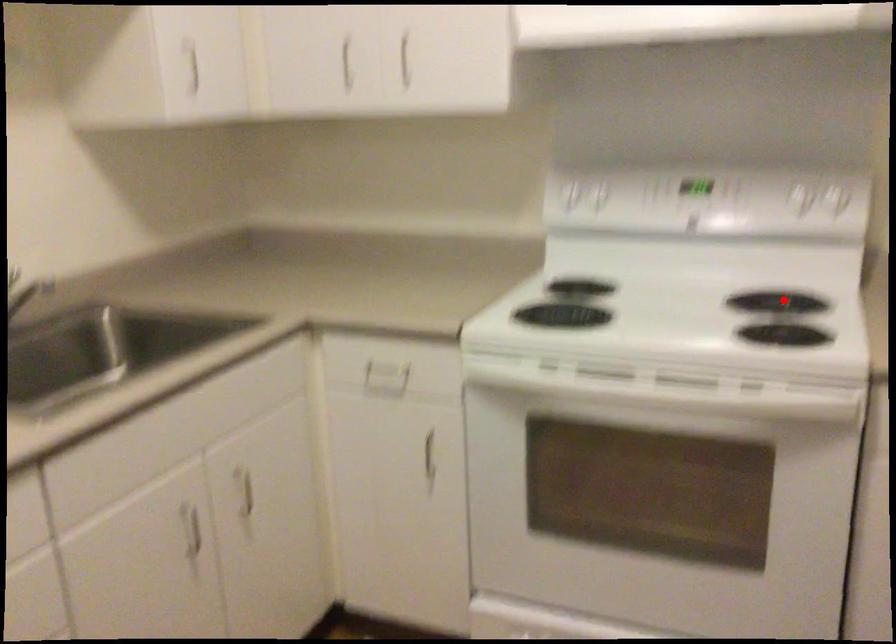
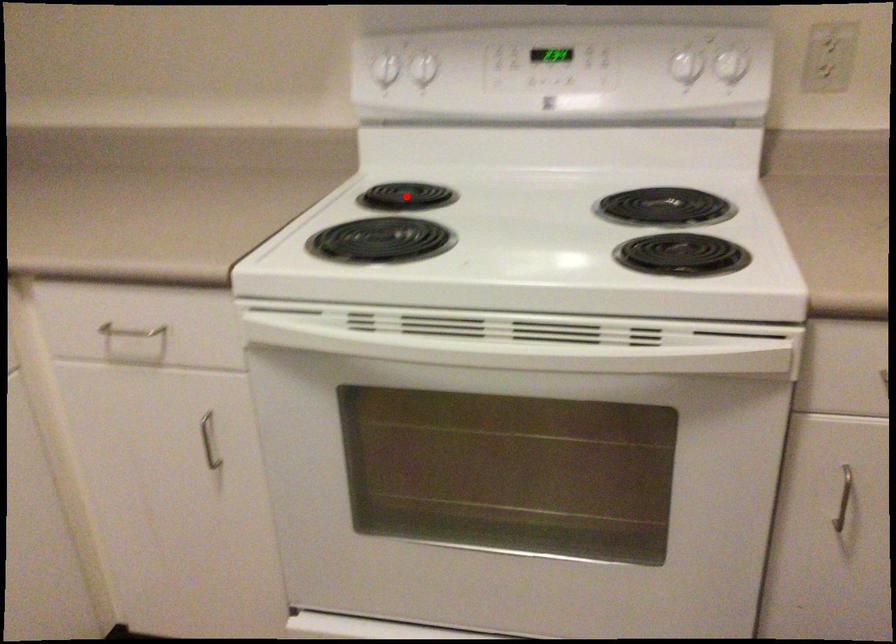
I am providing you with two images of the same scene from different viewpoints. A red point is marked on the first image and another point is marked on the second image. Does the point marked in image1 correspond to the same location as the one in image2?

No